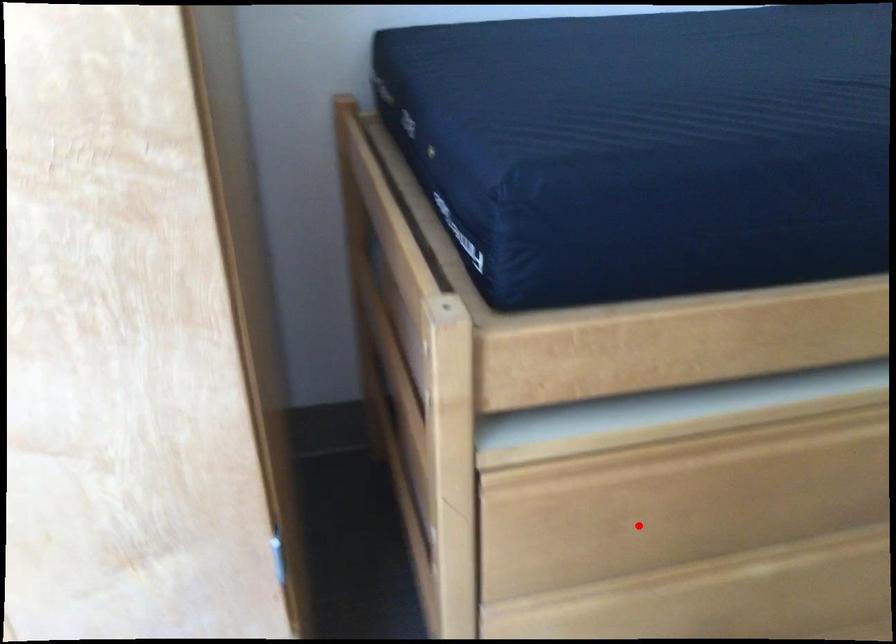
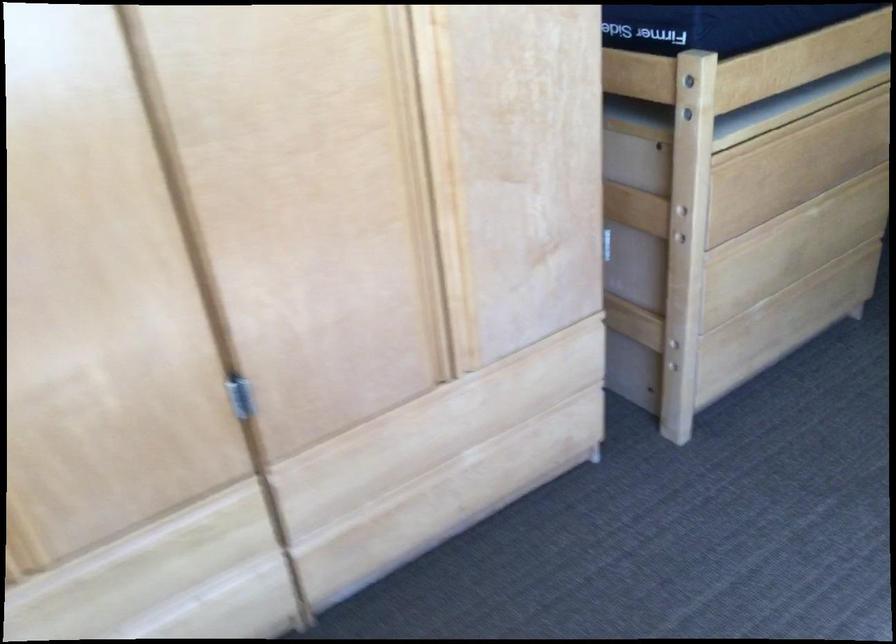
In the second image, find the point that corresponds to the highlighted location in the first image.

(767, 185)